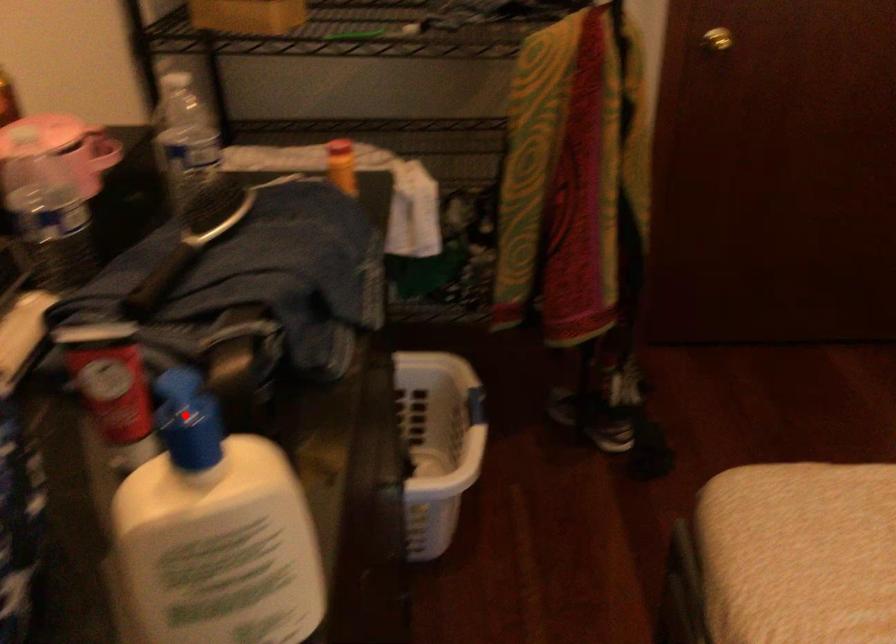
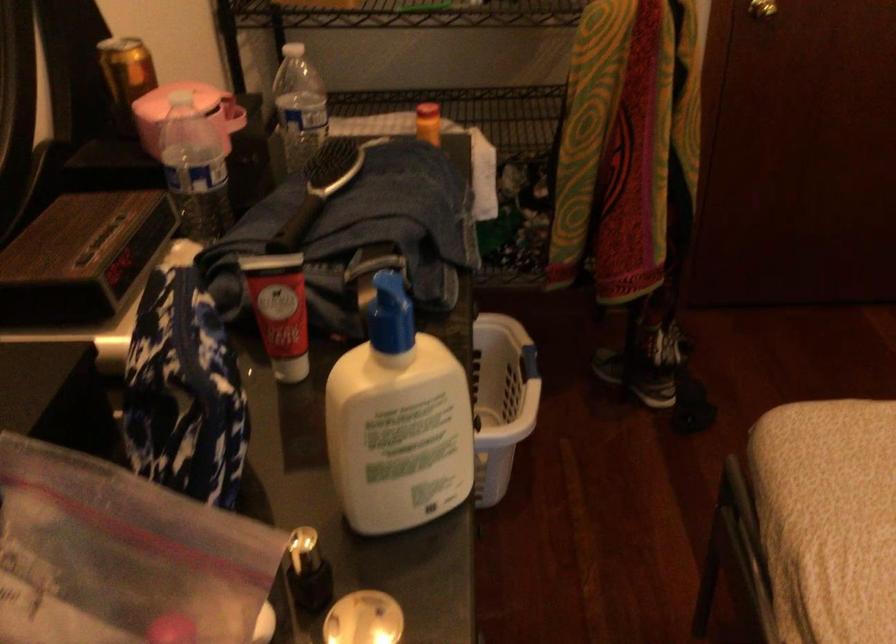
Find the pixel in the second image that matches the highlighted location in the first image.

(391, 314)